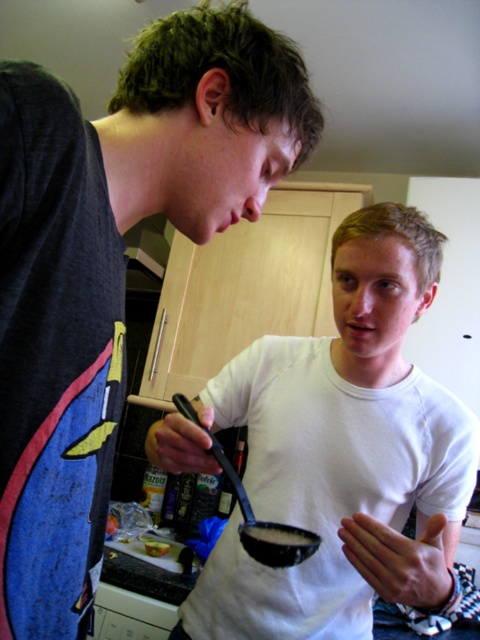
Question: Which point is closer to the camera taking this photo?

Choices:
 (A) (313, 550)
 (B) (162, 544)

Answer: (A)

Question: Among these objects, which one is nearest to the camera?

Choices:
 (A) black glossy pan at center
 (B) white matte bowl at center

Answer: (B)

Question: Can you confirm if white matte shirt at center is smaller than yellowish matte bread at lower left?

Choices:
 (A) yes
 (B) no

Answer: (B)

Question: Considering the relative positions of white matte shirt at center and white matte bowl at center in the image provided, where is white matte shirt at center located with respect to white matte bowl at center?

Choices:
 (A) left
 (B) right

Answer: (A)

Question: Does black glossy pan at center have a greater width compared to yellowish matte bread at lower left?

Choices:
 (A) yes
 (B) no

Answer: (A)

Question: Which point is closer to the camera taking this photo?

Choices:
 (A) (239, 525)
 (B) (197, 602)
 (C) (16, 177)
 (D) (165, 547)

Answer: (C)